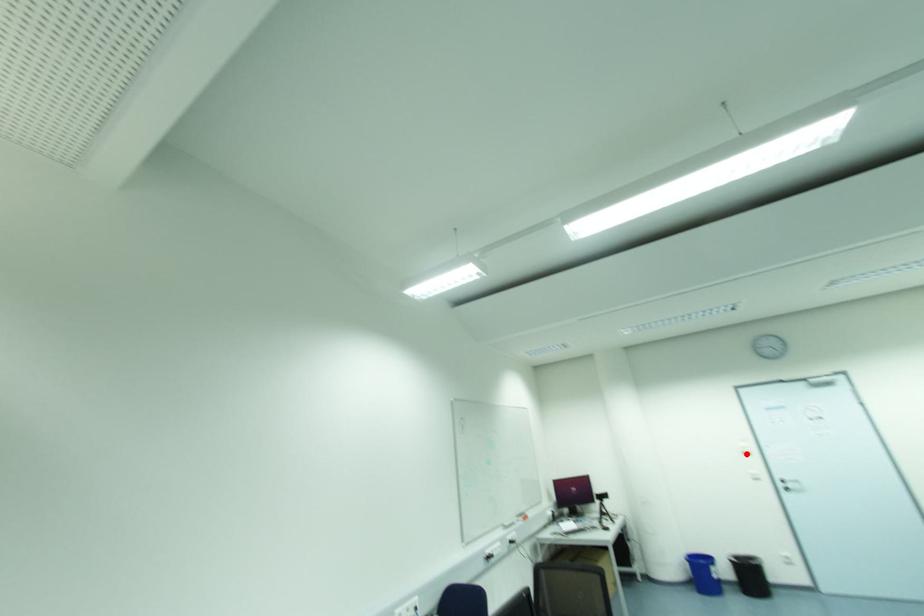
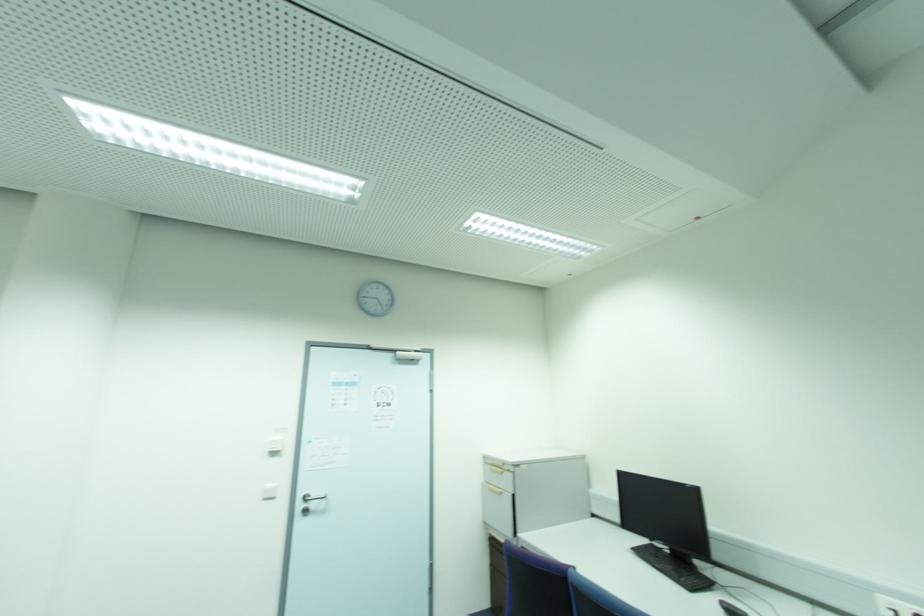
The point at the highlighted location is marked in the first image. Where is the corresponding point in the second image?

(274, 454)